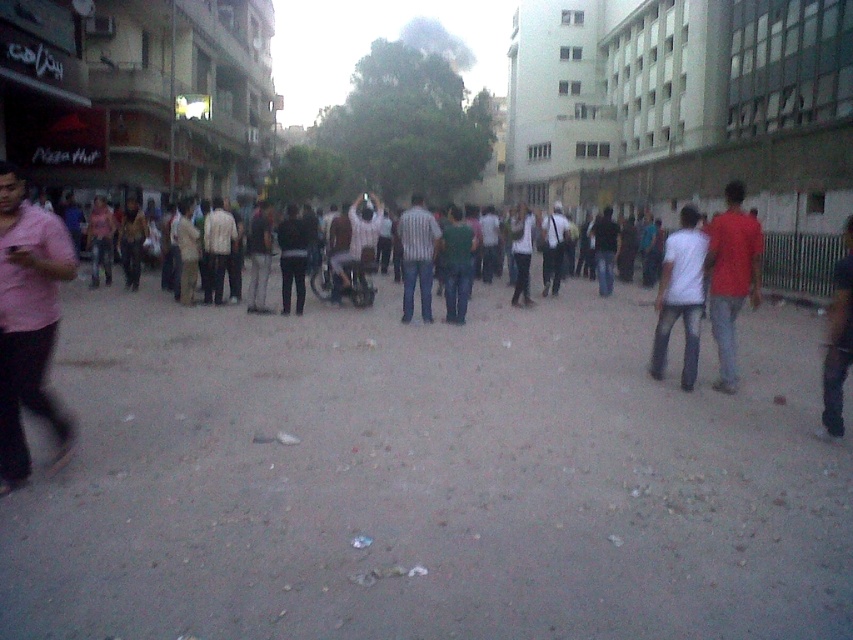
You are a photographer standing in the crowd and want to capture a photo of the pink matte shirt at left and the dark blue jeans at center. Based on their positions, which object is closer to the camera?

The pink matte shirt at left is positioned under dark blue jeans at center, so the pink matte shirt at left is closer to the camera.